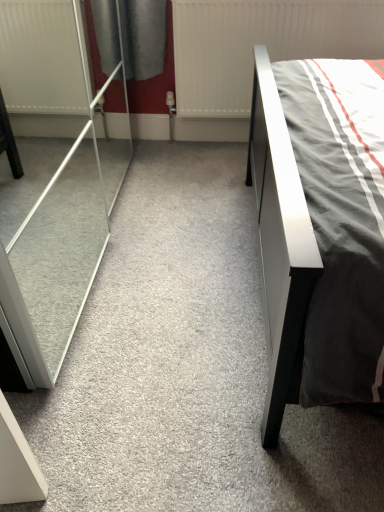
Question: Considering the relative positions of white textured radiator at upper center and transparent glass screen door at left in the image provided, is white textured radiator at upper center behind transparent glass screen door at left?

Choices:
 (A) no
 (B) yes

Answer: (B)

Question: Is white textured radiator at upper center outside of transparent glass screen door at left?

Choices:
 (A) yes
 (B) no

Answer: (A)

Question: Considering the relative sizes of white textured radiator at upper center and transparent glass screen door at left in the image provided, is white textured radiator at upper center thinner than transparent glass screen door at left?

Choices:
 (A) no
 (B) yes

Answer: (B)

Question: From a real-world perspective, is white textured radiator at upper center under transparent glass screen door at left?

Choices:
 (A) yes
 (B) no

Answer: (A)

Question: Is white textured radiator at upper center surrounding transparent glass screen door at left?

Choices:
 (A) no
 (B) yes

Answer: (A)

Question: Considering the relative sizes of white textured radiator at upper center and transparent glass screen door at left in the image provided, is white textured radiator at upper center shorter than transparent glass screen door at left?

Choices:
 (A) yes
 (B) no

Answer: (A)

Question: From a real-world perspective, is transparent glass screen door at left on top of white textured radiator at upper center?

Choices:
 (A) yes
 (B) no

Answer: (A)

Question: From the image's perspective, does transparent glass screen door at left appear lower than white textured radiator at upper center?

Choices:
 (A) no
 (B) yes

Answer: (B)

Question: Does transparent glass screen door at left come behind white textured radiator at upper center?

Choices:
 (A) yes
 (B) no

Answer: (B)

Question: Does transparent glass screen door at left appear on the right side of white textured radiator at upper center?

Choices:
 (A) no
 (B) yes

Answer: (A)

Question: Is transparent glass screen door at left facing away from white textured radiator at upper center?

Choices:
 (A) no
 (B) yes

Answer: (A)

Question: From the image's perspective, would you say transparent glass screen door at left is positioned over white textured radiator at upper center?

Choices:
 (A) yes
 (B) no

Answer: (B)

Question: Considering the positions of white textured radiator at upper center and transparent glass screen door at left in the image, is white textured radiator at upper center bigger or smaller than transparent glass screen door at left?

Choices:
 (A) small
 (B) big

Answer: (A)